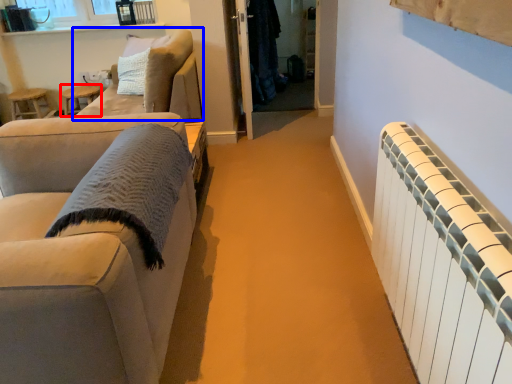
Question: Which point is closer to the camera, side table (highlighted by a red box) or studio couch (highlighted by a blue box)?

Choices:
 (A) side table
 (B) studio couch

Answer: (B)